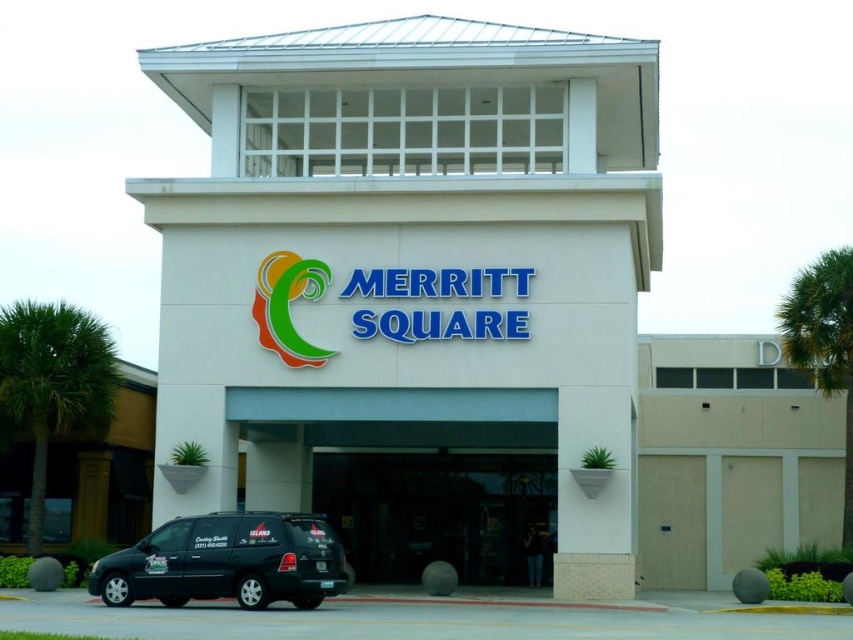
Question: Which point appears closest to the camera in this image?

Choices:
 (A) (280, 573)
 (B) (474, 522)

Answer: (A)

Question: Does transparent glass door at center have a greater width compared to matte black van at lower left?

Choices:
 (A) yes
 (B) no

Answer: (A)

Question: Among these points, which one is farthest from the camera?

Choices:
 (A) (390, 547)
 (B) (271, 568)

Answer: (A)

Question: Is transparent glass door at center further to the viewer compared to matte black van at lower left?

Choices:
 (A) yes
 (B) no

Answer: (A)

Question: Is transparent glass door at center to the right of matte black van at lower left from the viewer's perspective?

Choices:
 (A) no
 (B) yes

Answer: (B)

Question: Which of the following is the farthest from the observer?

Choices:
 (A) matte black van at lower left
 (B) transparent glass door at center

Answer: (B)